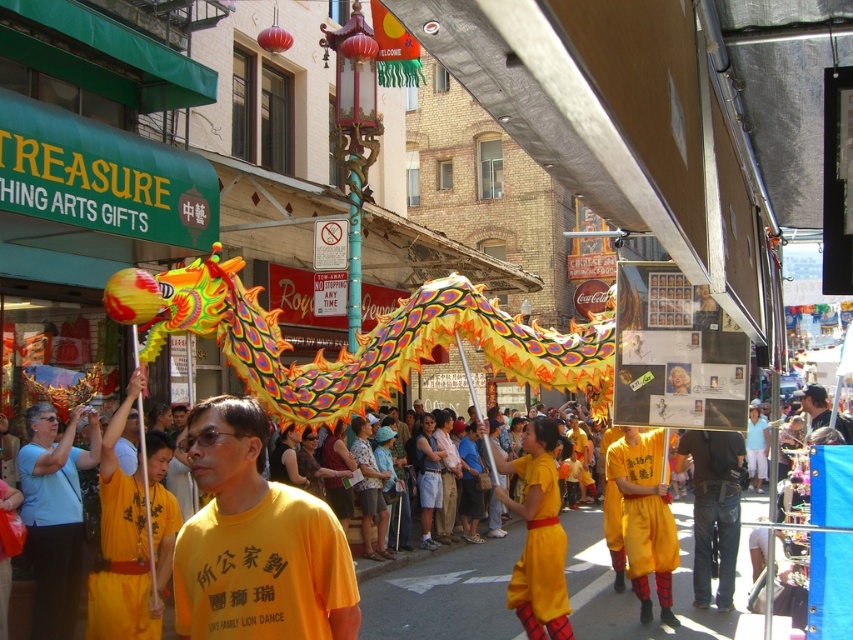
In the scene shown: Is yellow fabric dragon at center bigger than yellow matte shorts at center?

Yes, yellow fabric dragon at center is bigger than yellow matte shorts at center.

The width and height of the screenshot is (853, 640). Identify the location of yellow fabric dragon at center. (440, 593).

Which is behind, point (693, 632) or point (662, 592)?

The point (662, 592) is behind.

The image size is (853, 640). Identify the location of yellow fabric dragon at center. (440, 593).

Is yellow matte shorts at center bigger than yellow cotton shirt at center?

Actually, yellow matte shorts at center might be smaller than yellow cotton shirt at center.

Is yellow matte shorts at center positioned in front of yellow cotton shirt at center?

Yes, yellow matte shorts at center is in front of yellow cotton shirt at center.

The height and width of the screenshot is (640, 853). What do you see at coordinates (645, 515) in the screenshot? I see `yellow matte shorts at center` at bounding box center [645, 515].

This screenshot has width=853, height=640. I want to click on yellow matte shorts at center, so click(645, 515).

Consider the image. Does denim jeans at lower right appear over yellow cotton shirt at center?

Actually, denim jeans at lower right is below yellow cotton shirt at center.

Is denim jeans at lower right shorter than yellow cotton shirt at center?

Yes.

This screenshot has height=640, width=853. In order to click on denim jeans at lower right in this screenshot , I will do `click(714, 508)`.